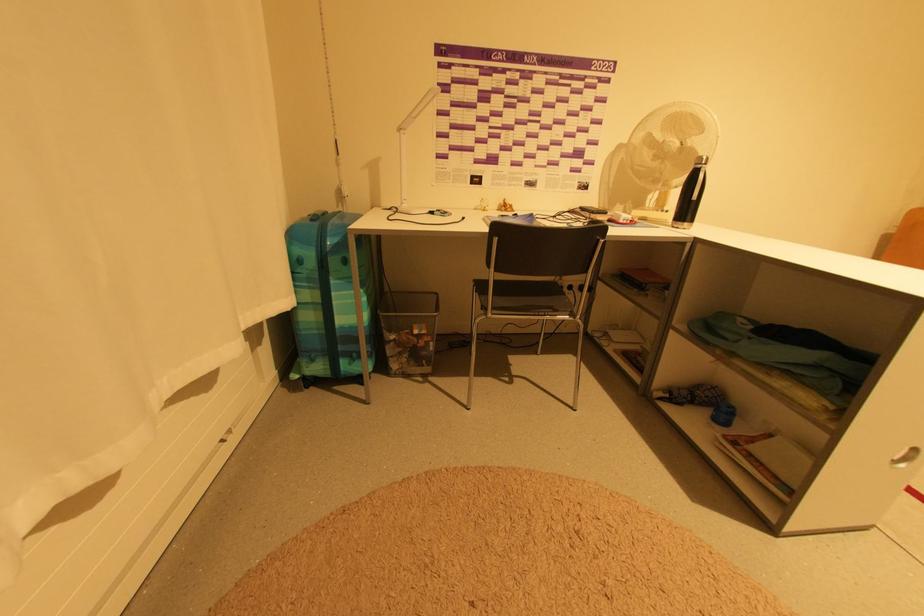
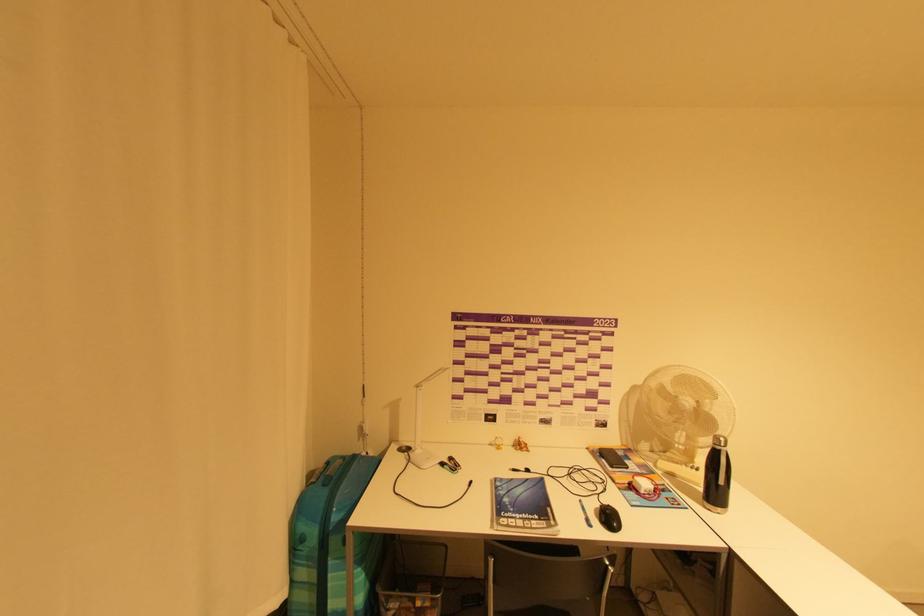
In the second image, find the point that corresponds to (x=708, y=159) in the first image.

(726, 440)